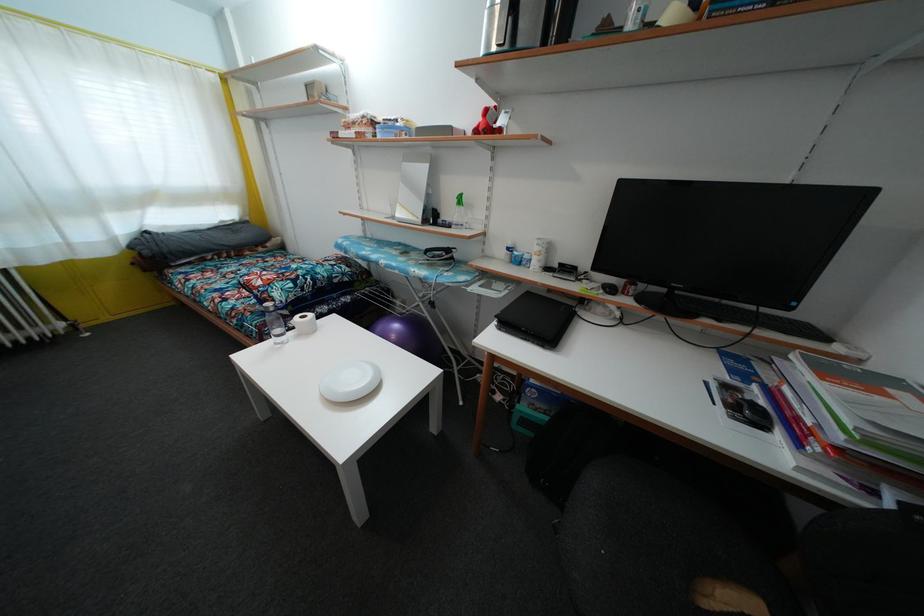
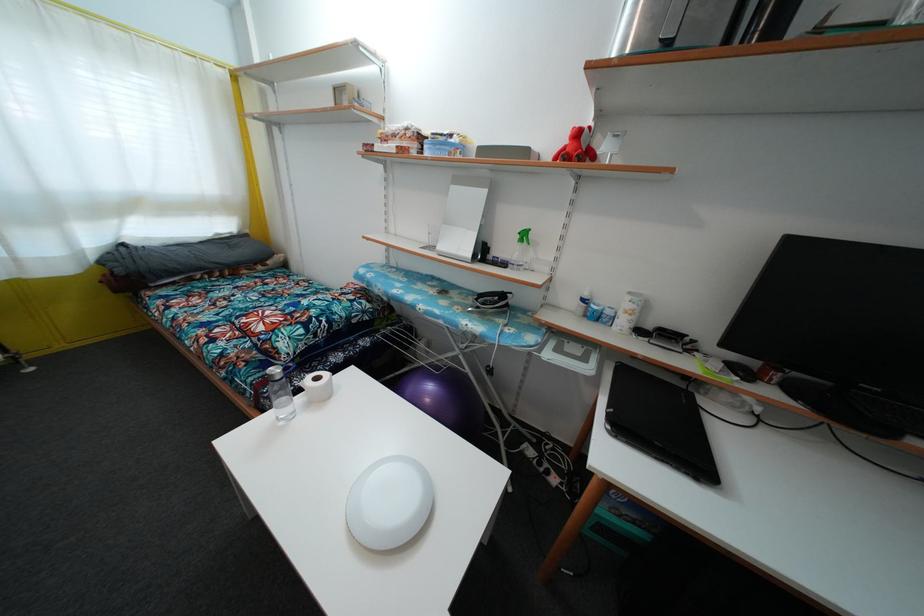
In the second image, find the point that corresponds to the point at 560,272 in the first image.

(652, 334)